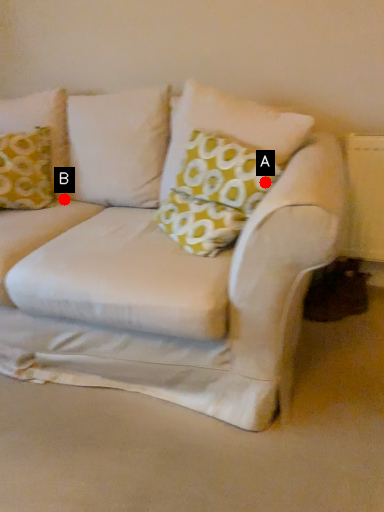
Question: Two points are circled on the image, labeled by A and B beside each circle. Which point is further to the camera?

Choices:
 (A) A is further
 (B) B is further

Answer: (B)